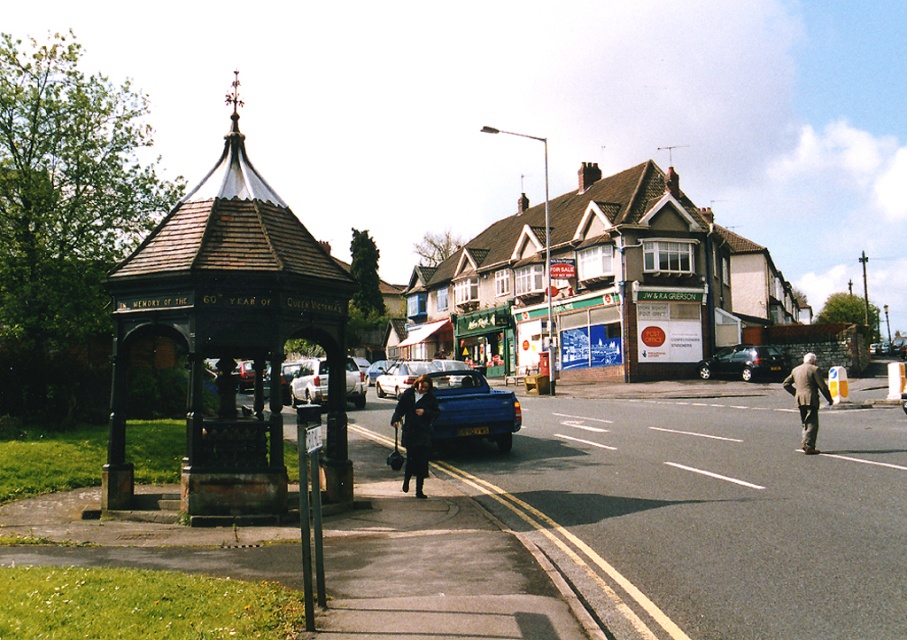
You are a delivery person who needs to place a large package on the sidewalk. The dark blue coat at center and the silver metallic car at center are in the way. Which object should you move to make more space?

You should move the dark blue coat at center because it occupies less space than the silver metallic car at center, so moving it would free up more space.

You are standing at the edge of the grassy area near the gazebo and want to cross the street to reach the shiny black car at center. Which direction should you walk to first reach the brown brick building at center before getting to the car?

The brown brick building at center is to the left of the shiny black car at center. Since you want to reach the brown brick building first before the car, you should walk towards the left direction from your current position near the gazebo.